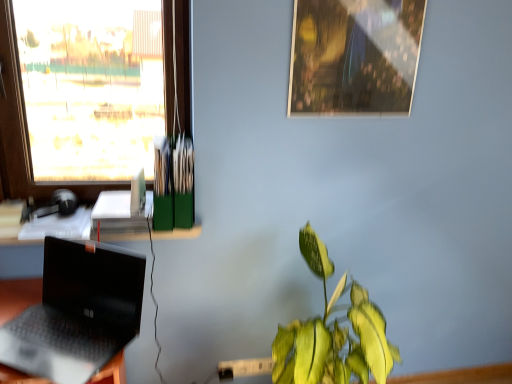
Question: Does metallic reflective photo frame at upper center have a lesser height compared to white plastic power outlet at lower center?

Choices:
 (A) yes
 (B) no

Answer: (B)

Question: From the image's perspective, is metallic reflective photo frame at upper center above white plastic power outlet at lower center?

Choices:
 (A) yes
 (B) no

Answer: (A)

Question: Is metallic reflective photo frame at upper center at the right side of white plastic power outlet at lower center?

Choices:
 (A) no
 (B) yes

Answer: (B)

Question: Is metallic reflective photo frame at upper center wider than white plastic power outlet at lower center?

Choices:
 (A) yes
 (B) no

Answer: (A)

Question: Does metallic reflective photo frame at upper center appear on the left side of white plastic power outlet at lower center?

Choices:
 (A) no
 (B) yes

Answer: (A)

Question: Considering the relative positions of green glossy leafy plant at lower right and black matte laptop at lower left in the image provided, is green glossy leafy plant at lower right to the left or to the right of black matte laptop at lower left?

Choices:
 (A) right
 (B) left

Answer: (A)

Question: Considering the positions of green glossy leafy plant at lower right and black matte laptop at lower left in the image, is green glossy leafy plant at lower right taller or shorter than black matte laptop at lower left?

Choices:
 (A) tall
 (B) short

Answer: (A)

Question: Considering the positions of green glossy leafy plant at lower right and black matte laptop at lower left in the image, is green glossy leafy plant at lower right bigger or smaller than black matte laptop at lower left?

Choices:
 (A) small
 (B) big

Answer: (B)

Question: Would you say green glossy leafy plant at lower right is inside or outside black matte laptop at lower left?

Choices:
 (A) outside
 (B) inside

Answer: (A)

Question: Considering their positions, is metallic reflective photo frame at upper center located in front of or behind transparent glass window at upper left?

Choices:
 (A) front
 (B) behind

Answer: (B)

Question: In terms of height, does metallic reflective photo frame at upper center look taller or shorter compared to transparent glass window at upper left?

Choices:
 (A) short
 (B) tall

Answer: (A)

Question: Is point (339, 94) positioned closer to the camera than point (9, 115)?

Choices:
 (A) closer
 (B) farther

Answer: (A)

Question: From a real-world perspective, relative to transparent glass window at upper left, is metallic reflective photo frame at upper center vertically above or below?

Choices:
 (A) below
 (B) above

Answer: (B)

Question: Is transparent glass window at upper left wider or thinner than green glossy leafy plant at lower right?

Choices:
 (A) thin
 (B) wide

Answer: (A)

Question: From the image's perspective, is transparent glass window at upper left above or below green glossy leafy plant at lower right?

Choices:
 (A) above
 (B) below

Answer: (A)